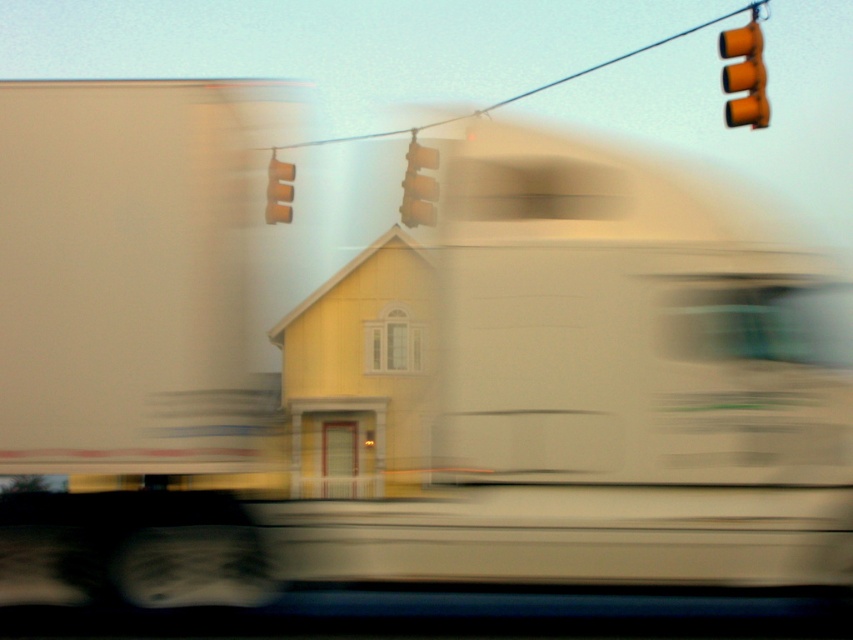
You are a driver approaching the yellow house with a red door. You notice two traffic lights in your view. Which traffic light takes up more space in your view? The yellow matte traffic light at center or the orange matte traffic light at upper center?

The orange matte traffic light at upper center takes up more space in your view because the yellow matte traffic light at center occupies less space than the orange matte traffic light at upper center.

You are a driver approaching the yellow matte traffic light at upper right while driving a car that is 15 feet long. If the traffic light is 70.96 feet away from you, how much distance will remain after your car has completely passed the traffic light?

After your car, which is 15 feet long, completely passes the yellow matte traffic light at upper right, there will be 70.96 feet minus 15 feet equals 55.96 feet remaining distance.

You are a driver approaching an intersection and see two traffic lights ahead. The yellow matte traffic light at upper right and the yellow matte traffic light at center. Which one is located to the right of the other?

The yellow matte traffic light at upper right is positioned on the right side of the yellow matte traffic light at center.